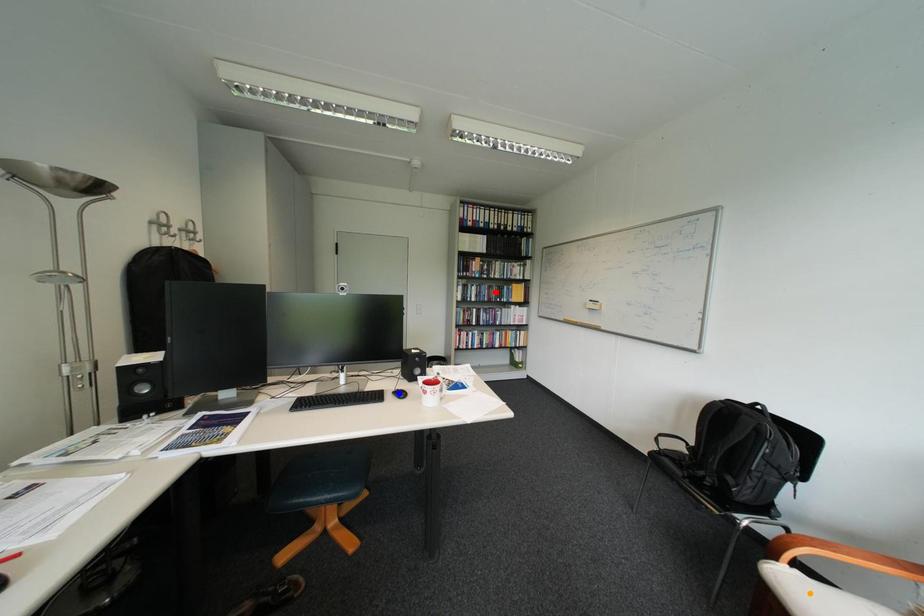
Order these from nearest to farthest:
orange point | red point | blue point

1. orange point
2. blue point
3. red point